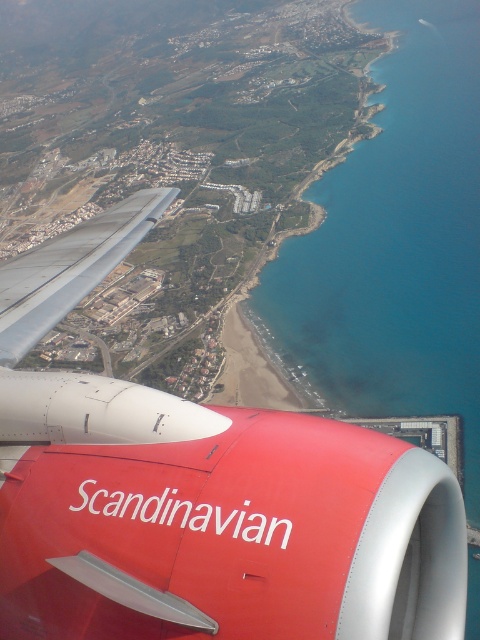
Does red matte airplane engine at lower left have a lesser height compared to blue water at lower center?

Yes, red matte airplane engine at lower left is shorter than blue water at lower center.

How much distance is there between red matte airplane engine at lower left and blue water at lower center?

They are 684.13 meters apart.

Between point (91, 400) and point (296, 237), which one is positioned in front?

Positioned in front is point (91, 400).

The width and height of the screenshot is (480, 640). I want to click on red matte airplane engine at lower left, so click(x=202, y=496).

Is blue water at lower center to the right of silver metallic wing at center-left from the viewer's perspective?

Indeed, blue water at lower center is positioned on the right side of silver metallic wing at center-left.

Is blue water at lower center smaller than silver metallic wing at center-left?

No.

Does point (443, 148) come in front of point (71, 301)?

No.

Identify the location of blue water at lower center. The width and height of the screenshot is (480, 640). (396, 241).

Which is behind, point (308, 506) or point (71, 252)?

Positioned behind is point (71, 252).

The height and width of the screenshot is (640, 480). What do you see at coordinates (202, 496) in the screenshot?
I see `red matte airplane engine at lower left` at bounding box center [202, 496].

The image size is (480, 640). Find the location of `red matte airplane engine at lower left`. red matte airplane engine at lower left is located at coordinates (202, 496).